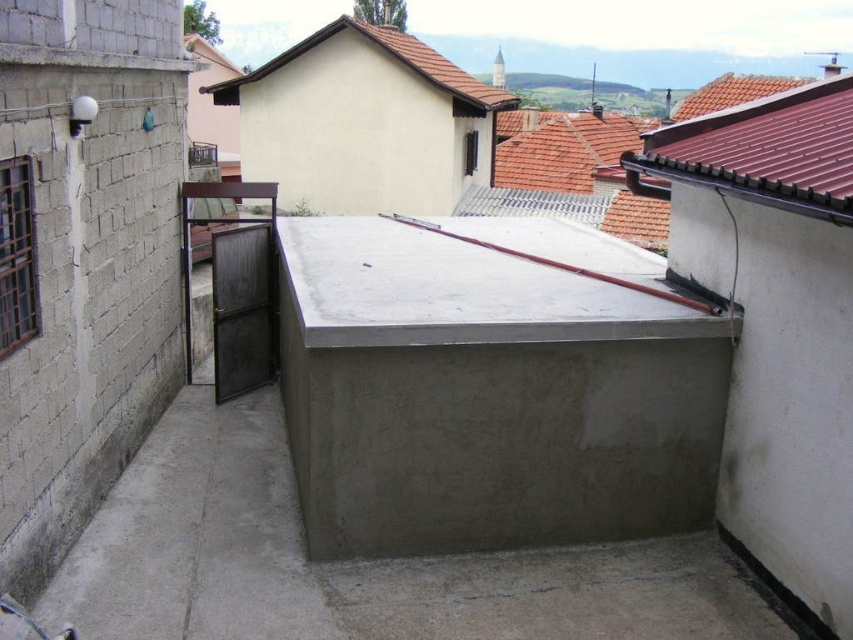
You are standing on the rooftop and want to place a new solar panel on the brown tile roof at upper right. According to the coordinates provided, where exactly should you position it?

The brown tile roof at upper right should be positioned at coordinates point (762, 150) as specified.

In the scene shown: You are standing on the rooftop and want to place a large potted plant between the gray concrete at center and the brown tile roof at upper center. Which object should you place it closer to to ensure it fits within the available space?

You should place the large potted plant closer to the gray concrete at center because its width is narrower than the brown tile roof at upper center, allowing more space for the plant.